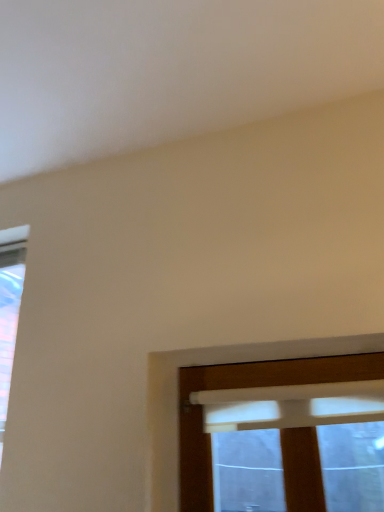
The height and width of the screenshot is (512, 384). What do you see at coordinates (242, 386) in the screenshot? I see `white plastic window at lower right` at bounding box center [242, 386].

Locate an element on the screen. The width and height of the screenshot is (384, 512). white plastic window at lower right is located at coordinates (242, 386).

I want to click on white plastic window at lower right, so click(242, 386).